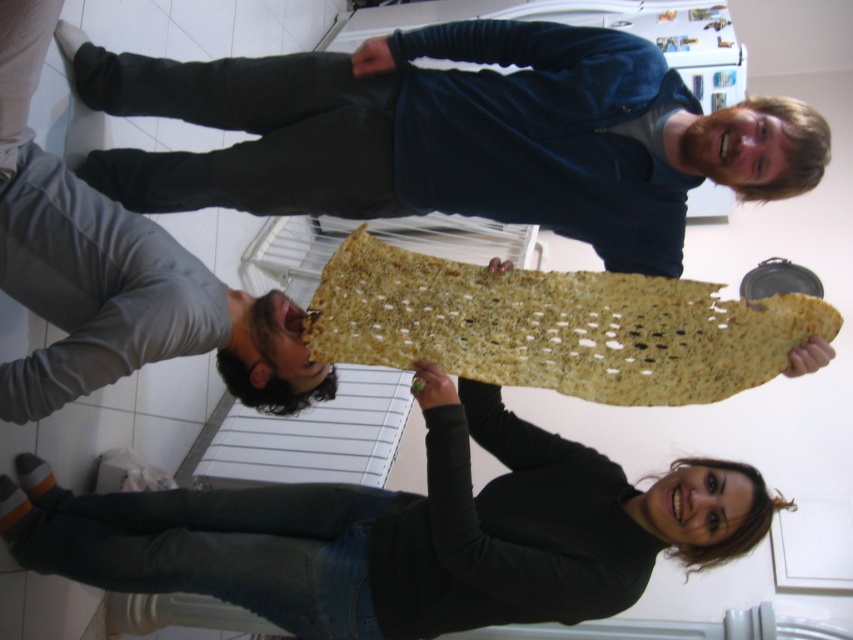
Question: Among these points, which one is farthest from the camera?

Choices:
 (A) (656, 106)
 (B) (755, 356)

Answer: (A)

Question: Which point is farther from the camera taking this photo?

Choices:
 (A) (776, 296)
 (B) (210, 72)
 (C) (532, 440)
 (D) (15, 19)

Answer: (B)

Question: Can you confirm if knitted fabric at upper center is positioned to the right of gray matte pants at lower left?

Choices:
 (A) no
 (B) yes

Answer: (B)

Question: Is knitted fabric at upper center thinner than golden textured matzah at center?

Choices:
 (A) no
 (B) yes

Answer: (A)

Question: Which object appears closest to the camera in this image?

Choices:
 (A) golden textured matzah at center
 (B) knitted fabric at upper center

Answer: (B)

Question: Can you confirm if knitted fabric at upper center is bigger than golden textured matzah at center?

Choices:
 (A) yes
 (B) no

Answer: (A)